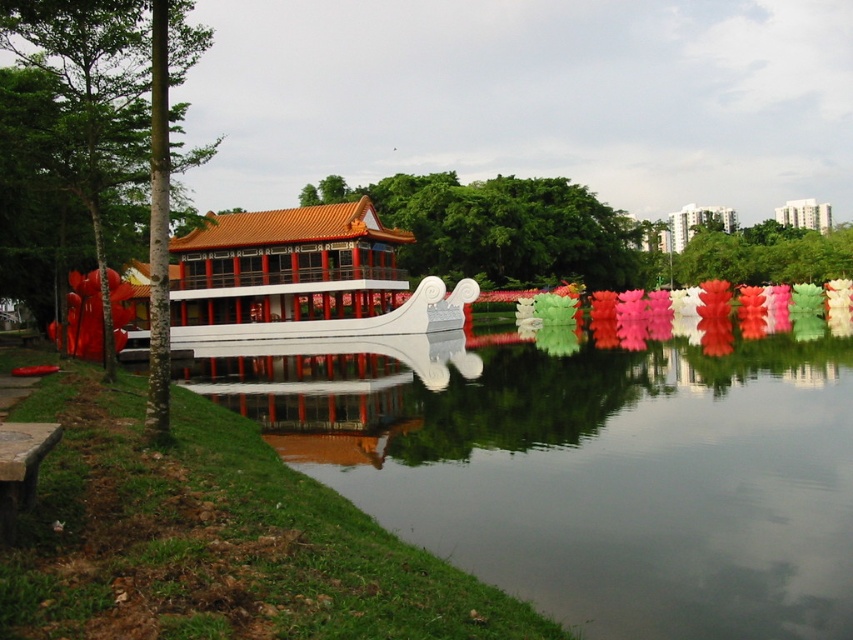
You are a visitor in the park and want to take a photo of the white glossy boat at center and the green smooth tree at left. Which object will appear smaller in the photo?

The white glossy boat at center will appear smaller in the photo because it has a lesser height compared to the green smooth tree at left.